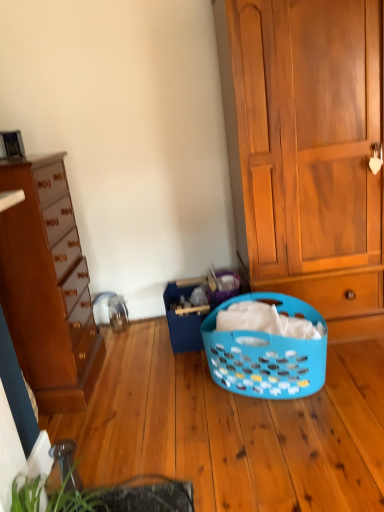
Question: In terms of height, does blue plastic laundry basket at center look taller or shorter compared to green leafy plant at lower left?

Choices:
 (A) tall
 (B) short

Answer: (B)

Question: Considering their positions, is blue plastic laundry basket at center located in front of or behind green leafy plant at lower left?

Choices:
 (A) front
 (B) behind

Answer: (B)

Question: Which object is the farthest from the wooden cabinet at right, which is counted as the 1th cabinetry, starting from the right?

Choices:
 (A) blue plastic laundry basket at center
 (B) green leafy plant at lower left
 (C) matte brown dresser at left, the 1th cabinetry viewed from the left
 (D) blue plastic laundry basket at center

Answer: (B)

Question: Which object is the farthest from the blue plastic laundry basket at center?

Choices:
 (A) wooden cabinet at right, which is counted as the 1th cabinetry, starting from the right
 (B) blue plastic laundry basket at center
 (C) matte brown dresser at left, the 2th cabinetry viewed from the right
 (D) green leafy plant at lower left

Answer: (D)